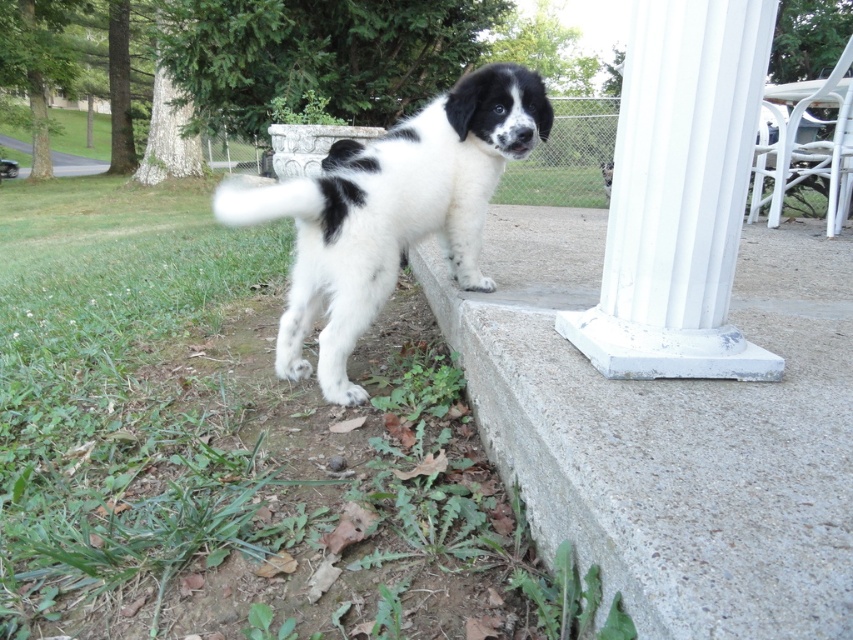
You are a small dog trying to jump onto the concrete at lower right and the white painted concrete column at center right. Which surface will be easier for you to jump onto?

The concrete at lower right has a lesser height compared to the white painted concrete column at center right, so it will be easier for the small dog to jump onto the concrete at lower right.

You are standing at the point marked as point [679,195]. You want to walk straight ahead to reach the black and white puppy. Will you bump into the white painted concrete column at center right before reaching the puppy?

The point [679,195] is on the white painted concrete column at center right, so if you start there and walk straight ahead, you would be moving away from the puppy, not towards it. Therefore, you won???t bump into the column before reaching the puppy because you???re already on the column itself.

You are a gardener who needs to place a new flower pot on the concrete at lower right. However, there is a white painted concrete column at center right nearby. Based on the scene, can you confirm if the column is directly above the concrete where you want to place the pot?

The concrete at lower right is positioned under the white painted concrete column at center right, so placing the flower pot there would mean the column is directly above it.